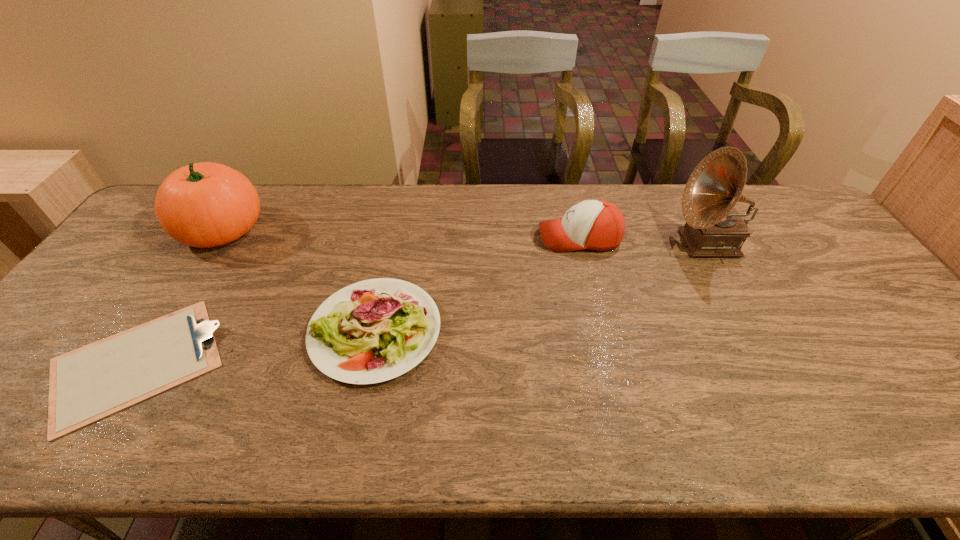
Identify the location of object that stands as the fourth closest to the phonograph record. The height and width of the screenshot is (540, 960). (205, 204).

Identify the location of free space in the image that satisfies the following two spatial constraints: 1. on the front-facing side of the fourth object from left to right; 2. on the front side of the third object from right to left. (602, 330).